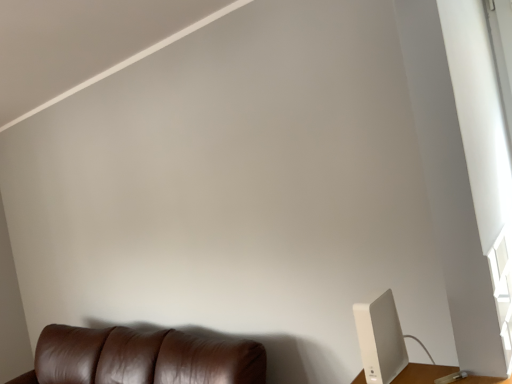
Measure the distance between brown leather couch at lower left and camera.

brown leather couch at lower left is 2.04 meters from camera.

Find the location of a particular element. brown leather couch at lower left is located at coordinates (143, 357).

The height and width of the screenshot is (384, 512). Describe the element at coordinates (143, 357) in the screenshot. I see `brown leather couch at lower left` at that location.

What is the approximate width of white plastic router at lower right?

white plastic router at lower right is 6.81 inches in width.

Find the location of a particular element. This screenshot has width=512, height=384. white plastic router at lower right is located at coordinates (380, 339).

The image size is (512, 384). What do you see at coordinates (380, 339) in the screenshot?
I see `white plastic router at lower right` at bounding box center [380, 339].

Measure the distance between point (x=400, y=357) and camera.

The distance of point (x=400, y=357) from camera is 1.51 meters.

The image size is (512, 384). I want to click on brown leather couch at lower left, so click(x=143, y=357).

Based on their positions, is white plastic router at lower right located to the left or right of brown leather couch at lower left?

From the image, it's evident that white plastic router at lower right is to the right of brown leather couch at lower left.

Considering their positions, is white plastic router at lower right located in front of or behind brown leather couch at lower left?

Clearly, white plastic router at lower right is in front of brown leather couch at lower left.

Which point is more distant from viewer, [365,351] or [203,347]?

The point [203,347] is behind.

From the image's perspective, which is above, white plastic router at lower right or brown leather couch at lower left?

white plastic router at lower right.

From a real-world perspective, is white plastic router at lower right over brown leather couch at lower left?

Yes.

Is white plastic router at lower right wider or thinner than brown leather couch at lower left?

white plastic router at lower right is thinner than brown leather couch at lower left.

Considering the sizes of white plastic router at lower right and brown leather couch at lower left in the image, is white plastic router at lower right taller or shorter than brown leather couch at lower left?

white plastic router at lower right is shorter than brown leather couch at lower left.

Can you confirm if white plastic router at lower right is bigger than brown leather couch at lower left?

No, white plastic router at lower right is not bigger than brown leather couch at lower left.

Can brown leather couch at lower left be found inside white plastic router at lower right?

No, brown leather couch at lower left is not surrounded by white plastic router at lower right.

Is white plastic router at lower right not close to brown leather couch at lower left?

Yes, white plastic router at lower right and brown leather couch at lower left are located far from each other.

Looking at this image, is white plastic router at lower right oriented towards brown leather couch at lower left?

No, white plastic router at lower right is not turned towards brown leather couch at lower left.

At what (x,y) coordinates should I click in order to perform the action: click on computer monitor located above the brown leather couch at lower left (from a real-world perspective). Please return your answer as a coordinate pair (x, y). The height and width of the screenshot is (384, 512). Looking at the image, I should click on (380, 339).

Considering the positions of objects brown leather couch at lower left and white plastic router at lower right in the image provided, who is more to the left, brown leather couch at lower left or white plastic router at lower right?

From the viewer's perspective, brown leather couch at lower left appears more on the left side.

Does brown leather couch at lower left lie behind white plastic router at lower right?

Yes, brown leather couch at lower left is behind white plastic router at lower right.

Is point (90, 332) closer or farther from the camera than point (370, 324)?

Point (90, 332) is farther from the camera than point (370, 324).

From the image's perspective, would you say brown leather couch at lower left is positioned over white plastic router at lower right?

Incorrect, from the image's perspective, brown leather couch at lower left is lower than white plastic router at lower right.

From a real-world perspective, which is physically below, brown leather couch at lower left or white plastic router at lower right?

brown leather couch at lower left, from a real-world perspective.

Which object is wider, brown leather couch at lower left or white plastic router at lower right?

With larger width is brown leather couch at lower left.

From the picture: Does brown leather couch at lower left have a greater height compared to white plastic router at lower right?

Indeed, brown leather couch at lower left has a greater height compared to white plastic router at lower right.

Is brown leather couch at lower left bigger or smaller than white plastic router at lower right?

Clearly, brown leather couch at lower left is larger in size than white plastic router at lower right.

Is brown leather couch at lower left surrounding white plastic router at lower right?

No, white plastic router at lower right is not inside brown leather couch at lower left.

Is brown leather couch at lower left next to white plastic router at lower right?

No, brown leather couch at lower left is not next to white plastic router at lower right.

Is brown leather couch at lower left turned away from white plastic router at lower right?

No, brown leather couch at lower left is not facing the opposite direction of white plastic router at lower right.

What's the angular difference between brown leather couch at lower left and white plastic router at lower right's facing directions?

9.85 degrees separate the facing orientations of brown leather couch at lower left and white plastic router at lower right.

Locate an element on the screen. This screenshot has width=512, height=384. furniture that appears behind the white plastic router at lower right is located at coordinates (143, 357).

This screenshot has height=384, width=512. Find the location of `furniture to the left of white plastic router at lower right`. furniture to the left of white plastic router at lower right is located at coordinates (143, 357).

The height and width of the screenshot is (384, 512). In order to click on computer monitor above the brown leather couch at lower left (from a real-world perspective) in this screenshot , I will do `click(380, 339)`.